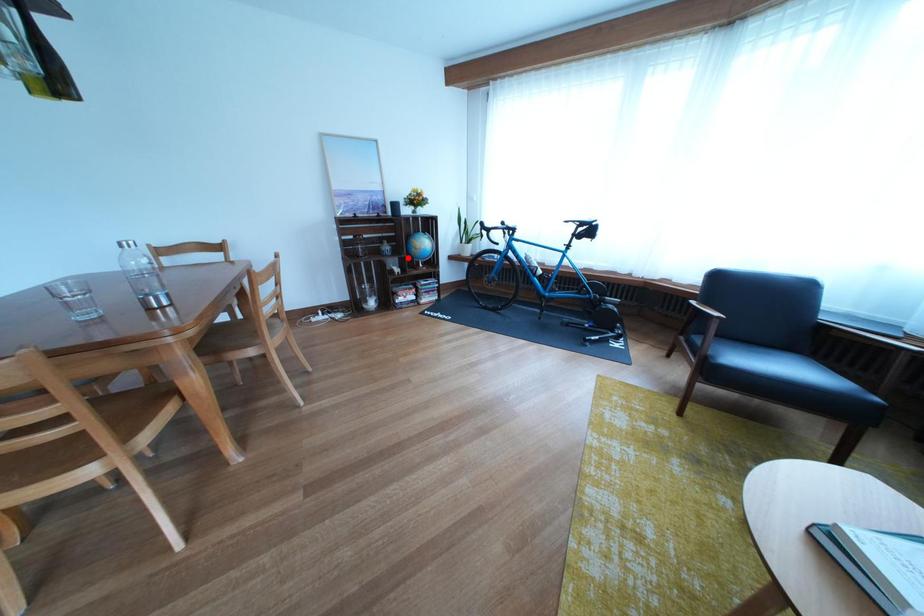
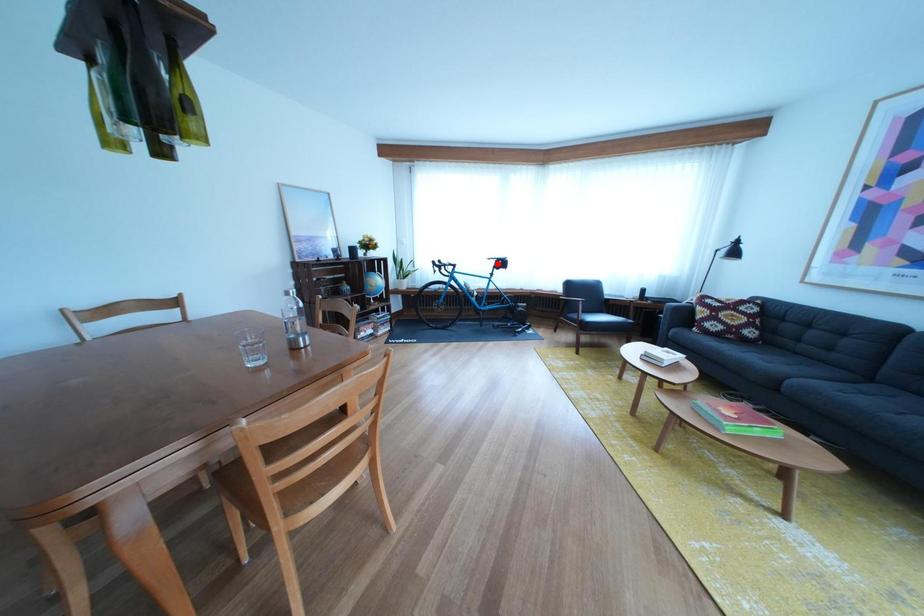
In the scene shown: I am providing you with two images of the same scene from different viewpoints. A red point is marked on the first image and another point is marked on the second image. Are the points marked in image1 and image2 representing the same 3D position?

No